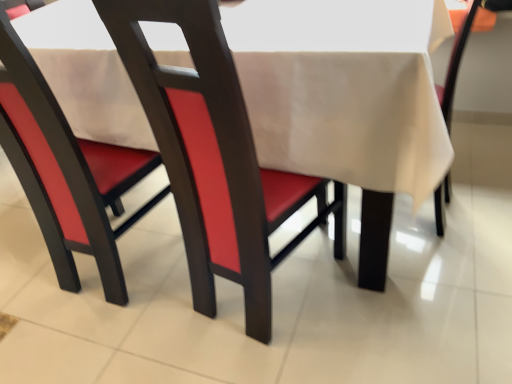
Question: Considering the positions of point (39, 115) and point (371, 66), is point (39, 115) closer or farther from the camera than point (371, 66)?

Choices:
 (A) closer
 (B) farther

Answer: (B)

Question: From a real-world perspective, is matte red chair at center, arranged as the 3th chair when viewed from the right, physically located above or below beige fabric tablecloth at center?

Choices:
 (A) below
 (B) above

Answer: (B)

Question: Based on their relative distances, which object is nearer to the matte red chair at center, acting as the 1th chair starting from the left?

Choices:
 (A) beige fabric tablecloth at center
 (B) beige fabric chair at center, marked as the 1th chair in a right-to-left arrangement
 (C) matte wood chair at center, which is counted as the second chair, starting from the right

Answer: (A)

Question: Estimate the real-world distances between objects in this image. Which object is farther from the beige fabric chair at center, marked as the 1th chair in a right-to-left arrangement?

Choices:
 (A) beige fabric tablecloth at center
 (B) matte red chair at center, arranged as the 3th chair when viewed from the right
 (C) matte wood chair at center, which is counted as the second chair, starting from the right

Answer: (B)